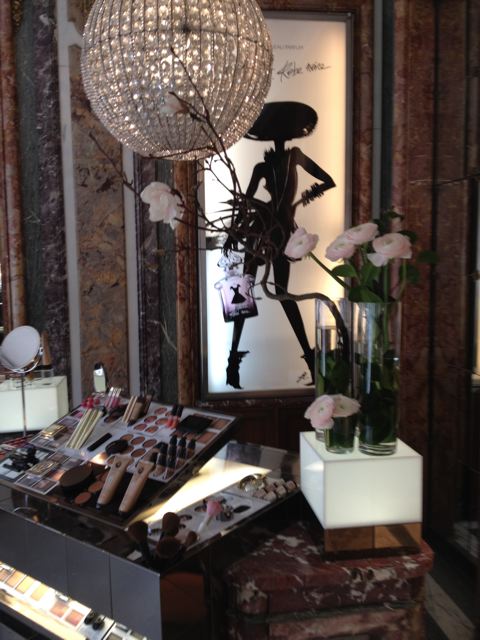
The width and height of the screenshot is (480, 640). In order to click on makeup counter in this screenshot , I will do `click(210, 564)`.